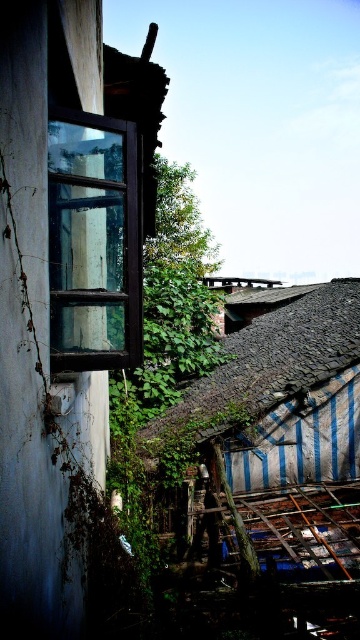
Question: Can you confirm if dark brown wooden window at left is wider than rusty corrugated metal roof at center?

Choices:
 (A) no
 (B) yes

Answer: (A)

Question: In this image, where is wooden window frame at left located relative to rusty corrugated metal roof at center?

Choices:
 (A) left
 (B) right

Answer: (A)

Question: Is dark brown wooden window at left behind rusty corrugated metal roof at center?

Choices:
 (A) yes
 (B) no

Answer: (B)

Question: Based on their relative distances, which object is nearer to the wooden window frame at left?

Choices:
 (A) dark brown wooden window at left
 (B) rusty corrugated metal roof at center

Answer: (A)

Question: Which of the following is the closest to the observer?

Choices:
 (A) (65, 308)
 (B) (165, 412)
 (C) (56, 259)

Answer: (A)

Question: Which point is closer to the camera?

Choices:
 (A) dark brown wooden window at left
 (B) wooden window frame at left
 (C) rusty corrugated metal roof at center

Answer: (B)